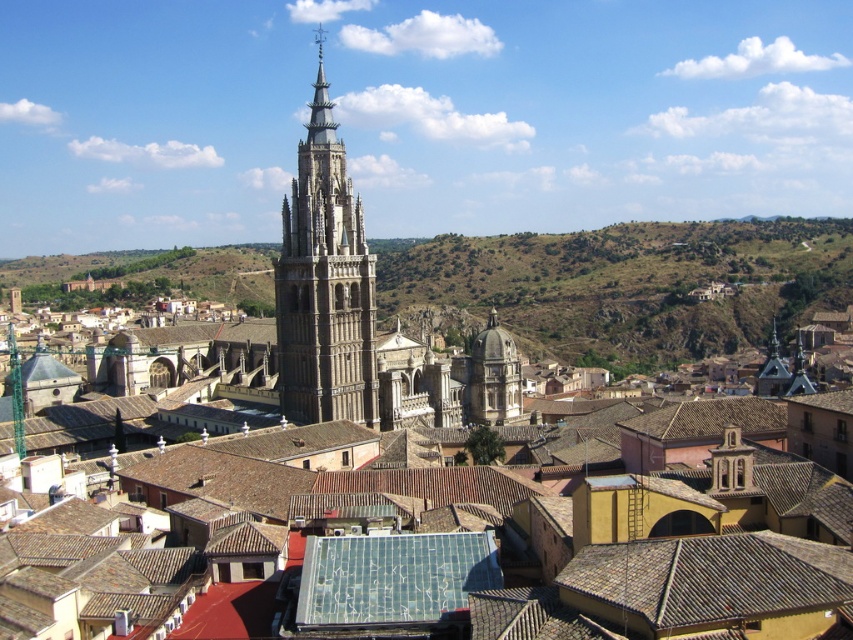
Can you confirm if stone gothic tower at center is positioned to the left of smooth gray dome at center?

Yes, stone gothic tower at center is to the left of smooth gray dome at center.

This screenshot has width=853, height=640. Describe the element at coordinates (323, 282) in the screenshot. I see `stone gothic tower at center` at that location.

At what (x,y) coordinates should I click in order to perform the action: click on stone gothic tower at center. Please return your answer as a coordinate pair (x, y). Looking at the image, I should click on (323, 282).

You are a GUI agent. You are given a task and a screenshot of the screen. Output one action in this format:
    pyautogui.click(x=<x>, y=<y>)
    Task: Click on the stone gothic tower at center
    The height and width of the screenshot is (640, 853).
    Given the screenshot: What is the action you would take?
    pyautogui.click(x=323, y=282)

Is point (666, 241) in front of point (289, 400)?

No, (666, 241) is behind (289, 400).

Between brown rocky hillside at center and stone gothic tower at center, which one is positioned lower?

brown rocky hillside at center is below.

Is point (654, 262) positioned in front of point (318, 70)?

No, (654, 262) is further to viewer.

At what (x,y) coordinates should I click in order to perform the action: click on brown rocky hillside at center. Please return your answer as a coordinate pair (x, y). Looking at the image, I should click on (624, 285).

Does point (752, 532) come in front of point (514, 356)?

That is True.

From the picture: Is brown tile roof at lower right to the right of smooth gray dome at center from the viewer's perspective?

Indeed, brown tile roof at lower right is positioned on the right side of smooth gray dome at center.

This screenshot has height=640, width=853. I want to click on brown tile roof at lower right, so click(711, 584).

Where is `brown tile roof at lower right`? Image resolution: width=853 pixels, height=640 pixels. brown tile roof at lower right is located at coordinates pos(711,584).